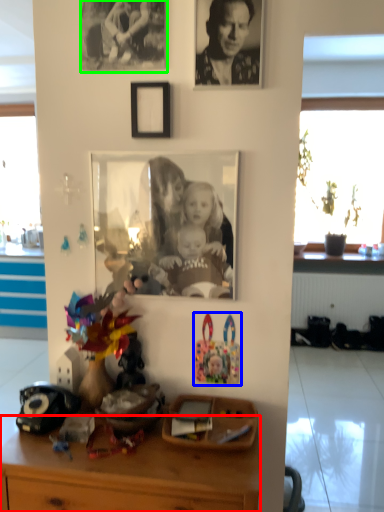
Question: Which object is the closest to the desk (highlighted by a red box)? Choose among these: toy (highlighted by a blue box) or picture frame (highlighted by a green box).

Choices:
 (A) toy
 (B) picture frame

Answer: (A)